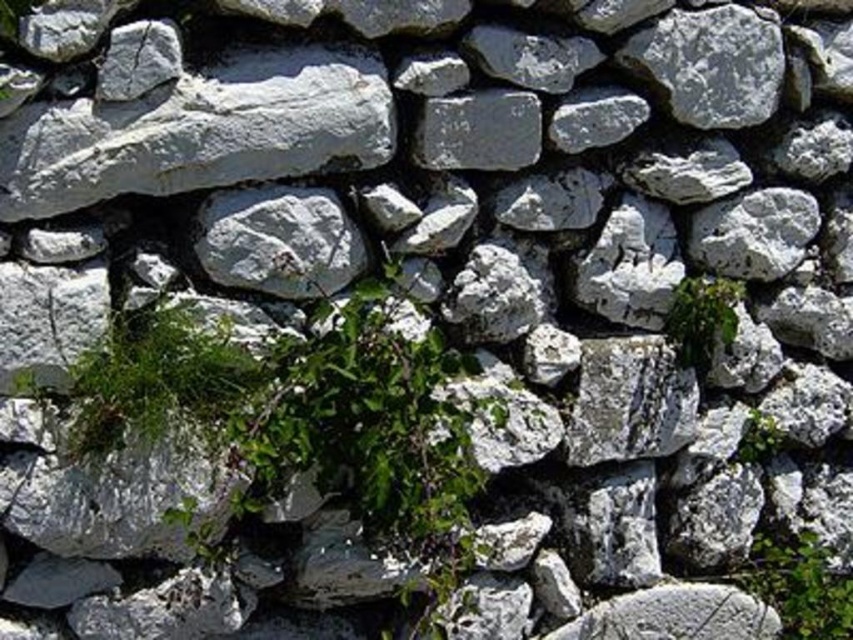
You are standing in front of a stone wall with a green leafy plant at center. You want to place a small statue exactly at the point marked by coordinates point (701, 317). Will the statue be placed on the green leafy plant at center?

The point (701, 317) corresponds to the green leafy plant at center, so placing the statue there would put it directly on the plant.

You are standing in front of a stone wall and see two points marked on it. The first point is at coordinates point (804, 602) and the second is at point (675, 308). Which point is closer to you?

Point (675, 308) is closer to you because it is in front of point (804, 602).